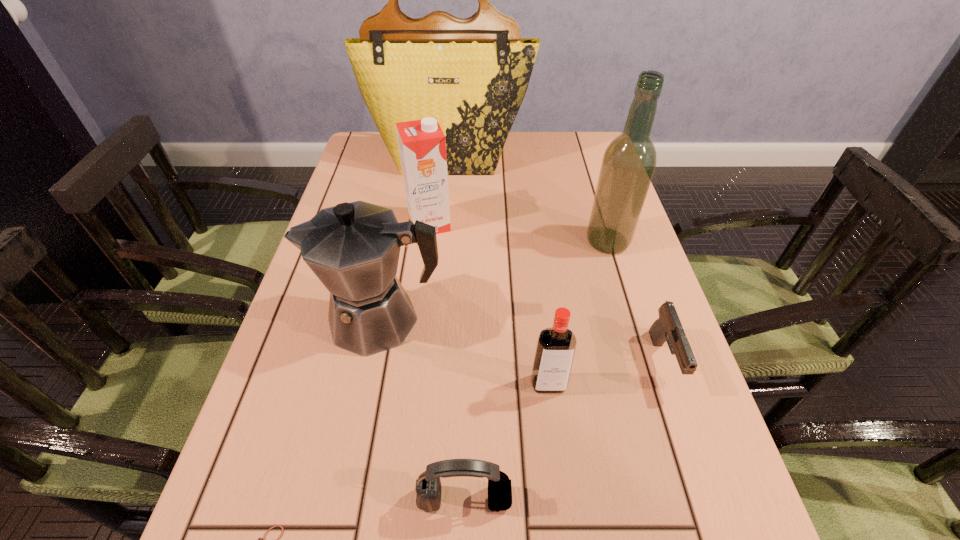
Where is `free space between the second tallest object and the pistol`? This screenshot has height=540, width=960. free space between the second tallest object and the pistol is located at coordinates (636, 301).

This screenshot has height=540, width=960. Find the location of `free space between the carton and the seventh shortest object`. free space between the carton and the seventh shortest object is located at coordinates (518, 233).

Identify the location of free space between the vodka and the liquor. This screenshot has height=540, width=960. (578, 313).

This screenshot has width=960, height=540. What are the coordinates of `object that is the third closest to the liquor` in the screenshot? It's located at (422, 145).

Where is `object that ranks as the sixth closest to the carton`? The width and height of the screenshot is (960, 540). object that ranks as the sixth closest to the carton is located at coordinates (428, 487).

At what (x,y) coordinates should I click in order to perform the action: click on blank area in the image that satisfies the following two spatial constraints: 1. on the front-facing side of the tallest object; 2. on the right side of the liquor. Please return your answer as a coordinate pair (x, y). Looking at the image, I should click on (442, 241).

Identify the location of free space in the image that satisfies the following two spatial constraints: 1. on the front-facing side of the seventh shortest object; 2. on the left side of the tallest object. The image size is (960, 540). (442, 241).